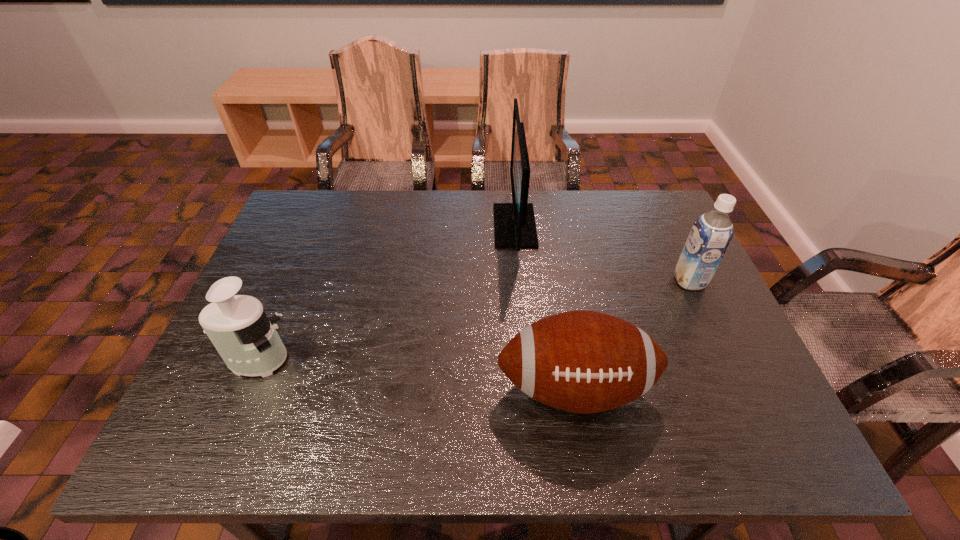
Find the location of `free space between the shortest object and the tallest object`. free space between the shortest object and the tallest object is located at coordinates (545, 307).

Find the location of `free area in between the juicer and the soya milk`. free area in between the juicer and the soya milk is located at coordinates (473, 320).

I want to click on free space between the monitor and the football, so click(x=545, y=307).

Image resolution: width=960 pixels, height=540 pixels. Identify the location of free area in between the football and the leftmost object. (416, 374).

Where is `free space between the monitor and the juicer`? The height and width of the screenshot is (540, 960). free space between the monitor and the juicer is located at coordinates coord(386,293).

Select which object is the third closest to the farthest object. Please provide its 2D coordinates. Your answer should be formatted as a tuple, i.e. [(x, y)], where the tuple contains the x and y coordinates of a point satisfying the conditions above.

[(237, 325)]

At what (x,y) coordinates should I click in order to perform the action: click on object that is the second closest to the monitor. Please return your answer as a coordinate pair (x, y). This screenshot has width=960, height=540. Looking at the image, I should click on (711, 234).

The width and height of the screenshot is (960, 540). In order to click on free spot that satisfies the following two spatial constraints: 1. on the label of the rightmost object; 2. on the laces of the shortest object in this screenshot , I will do `click(740, 388)`.